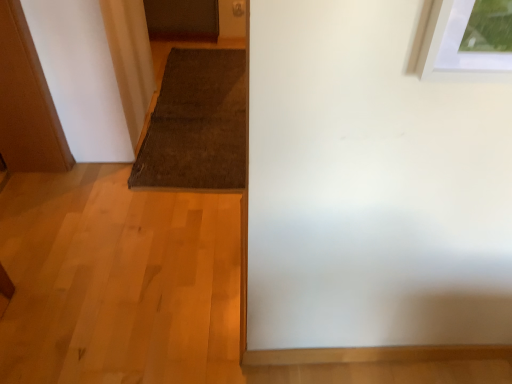
Question: Is wooden door at left to the left of brown textured mat at center from the viewer's perspective?

Choices:
 (A) no
 (B) yes

Answer: (B)

Question: Is wooden door at left taller than brown textured mat at center?

Choices:
 (A) no
 (B) yes

Answer: (B)

Question: Is wooden door at left thinner than brown textured mat at center?

Choices:
 (A) no
 (B) yes

Answer: (B)

Question: From the image's perspective, is wooden door at left on top of brown textured mat at center?

Choices:
 (A) no
 (B) yes

Answer: (A)

Question: Is wooden door at left closer to camera compared to brown textured mat at center?

Choices:
 (A) no
 (B) yes

Answer: (B)

Question: From the image's perspective, is wooden door at left beneath brown textured mat at center?

Choices:
 (A) yes
 (B) no

Answer: (A)

Question: Considering the relative positions of brown textured mat at center and wooden door at left in the image provided, is brown textured mat at center behind wooden door at left?

Choices:
 (A) no
 (B) yes

Answer: (B)

Question: Is brown textured mat at center oriented towards wooden door at left?

Choices:
 (A) yes
 (B) no

Answer: (B)

Question: From the image's perspective, is brown textured mat at center located beneath wooden door at left?

Choices:
 (A) no
 (B) yes

Answer: (A)

Question: Are brown textured mat at center and wooden door at left beside each other?

Choices:
 (A) no
 (B) yes

Answer: (A)

Question: From a real-world perspective, is brown textured mat at center over wooden door at left?

Choices:
 (A) yes
 (B) no

Answer: (B)

Question: Would you consider brown textured mat at center to be distant from wooden door at left?

Choices:
 (A) yes
 (B) no

Answer: (B)

Question: Based on their sizes in the image, would you say brown textured mat at center is bigger or smaller than wooden door at left?

Choices:
 (A) big
 (B) small

Answer: (B)